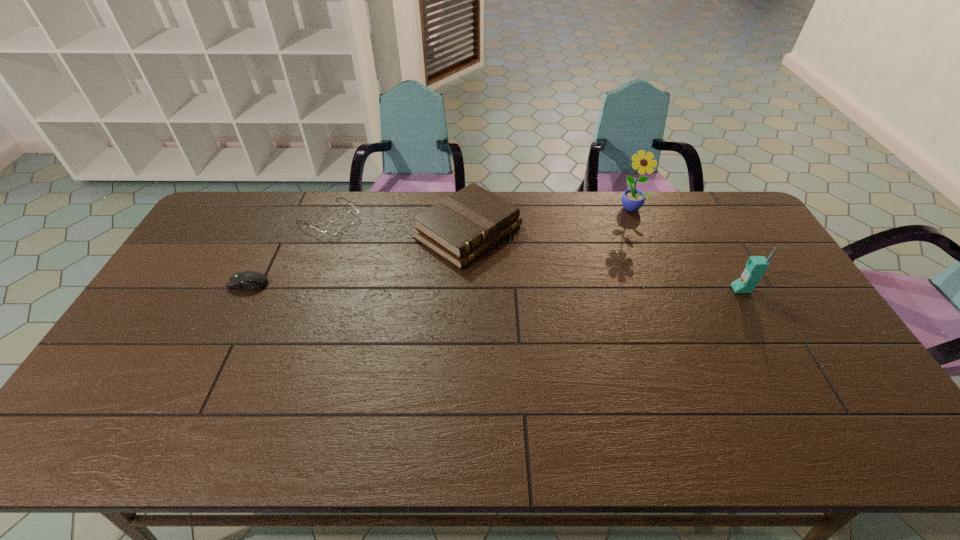
Identify the location of free space on the desktop that is between the computer equipment and the second tallest object and is positioned on the front-facing side of the sunflower. (562, 287).

Image resolution: width=960 pixels, height=540 pixels. Find the location of `free spot on the desktop that is between the shortest object and the fourth shortest object and is positioned on the spine side of the Bible`. free spot on the desktop that is between the shortest object and the fourth shortest object and is positioned on the spine side of the Bible is located at coordinates (559, 287).

Where is `free spot on the desktop that is between the computer equipment and the fourth shortest object and is positioned through the lenses of the spectacles`? The width and height of the screenshot is (960, 540). free spot on the desktop that is between the computer equipment and the fourth shortest object and is positioned through the lenses of the spectacles is located at coordinates (429, 286).